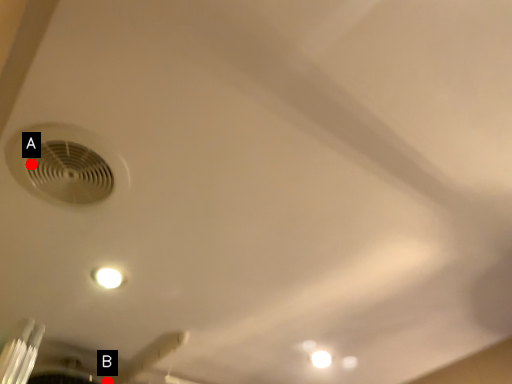
Question: Two points are circled on the image, labeled by A and B beside each circle. Which of the following is the farthest from the observer?

Choices:
 (A) A is further
 (B) B is further

Answer: (B)